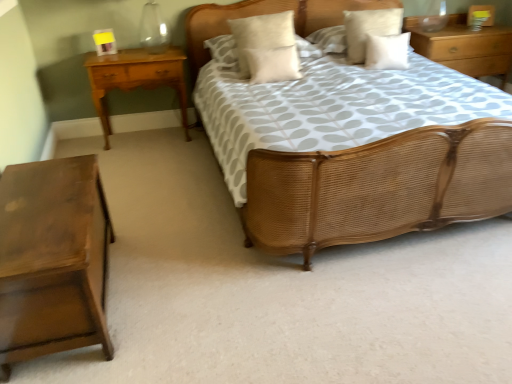
At what (x,y) coordinates should I click in order to perform the action: click on vacant region in front of light brown wood nightstand at left, the 2th nightstand viewed from the front. Please return your answer as a coordinate pair (x, y). Looking at the image, I should click on (168, 162).